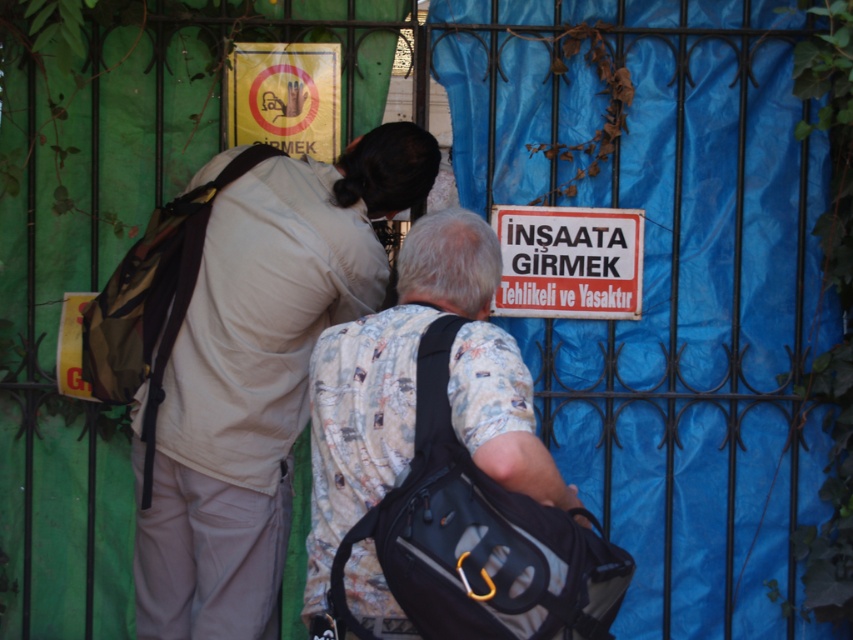
Between point (575, 291) and point (335, 80), which one is positioned in front?

Positioned in front is point (335, 80).

Which is below, white paper sign at center or yellow paper sign at upper center?

Positioned lower is white paper sign at center.

Does point (602, 276) come behind point (292, 100)?

Yes.

Identify the location of white paper sign at center. (569, 260).

Which of these two, printed cotton shirt at center or white paper sign at center, stands taller?

Standing taller between the two is printed cotton shirt at center.

Is printed cotton shirt at center shorter than white paper sign at center?

In fact, printed cotton shirt at center may be taller than white paper sign at center.

Identify the location of printed cotton shirt at center. (415, 388).

Looking at this image, can you confirm if matte beige shirt at center is smaller than yellow paper sign at upper center?

No.

Who is positioned more to the left, matte beige shirt at center or yellow paper sign at upper center?

matte beige shirt at center

Which is in front, point (271, 230) or point (323, 80)?

Point (271, 230)

In order to click on matte beige shirt at center in this screenshot , I will do `click(257, 376)`.